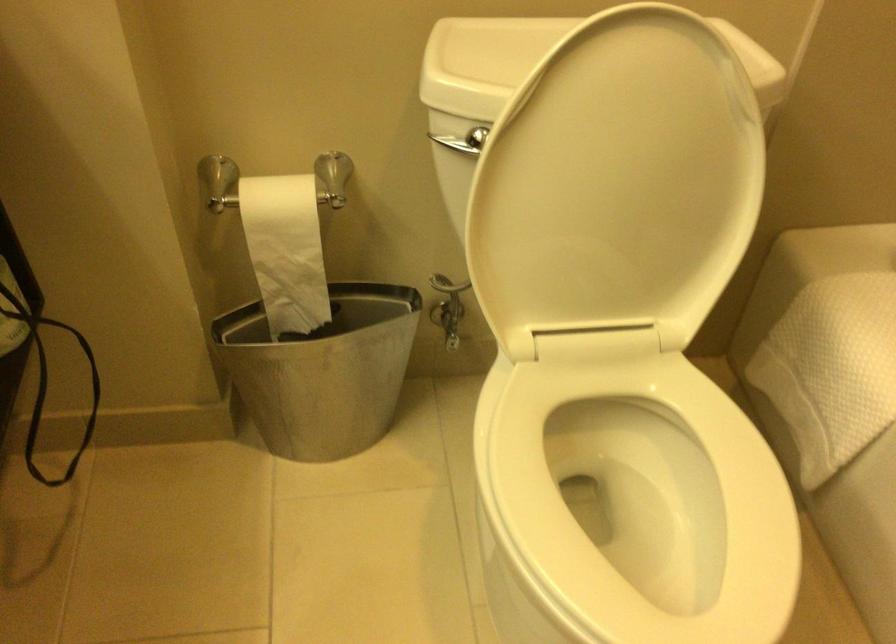
Find the location of a particular element. The image size is (896, 644). toilet flush handle is located at coordinates (446, 145).